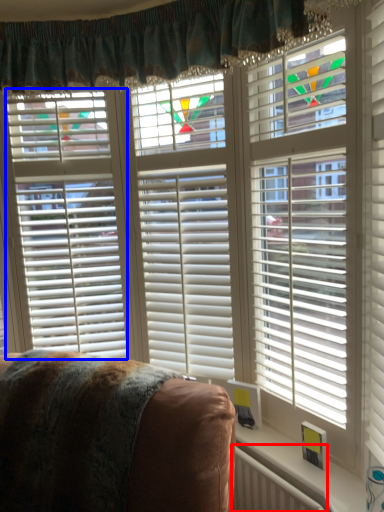
Question: Which of the following is the farthest to the observer, radiator (highlighted by a red box) or blind (highlighted by a blue box)?

Choices:
 (A) radiator
 (B) blind

Answer: (B)